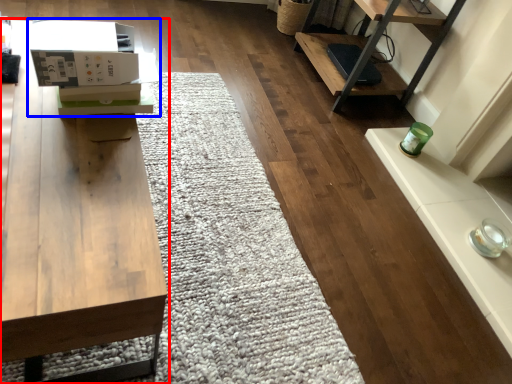
Question: Which object is further to the camera taking this photo, table (highlighted by a red box) or cardboard box (highlighted by a blue box)?

Choices:
 (A) table
 (B) cardboard box

Answer: (B)